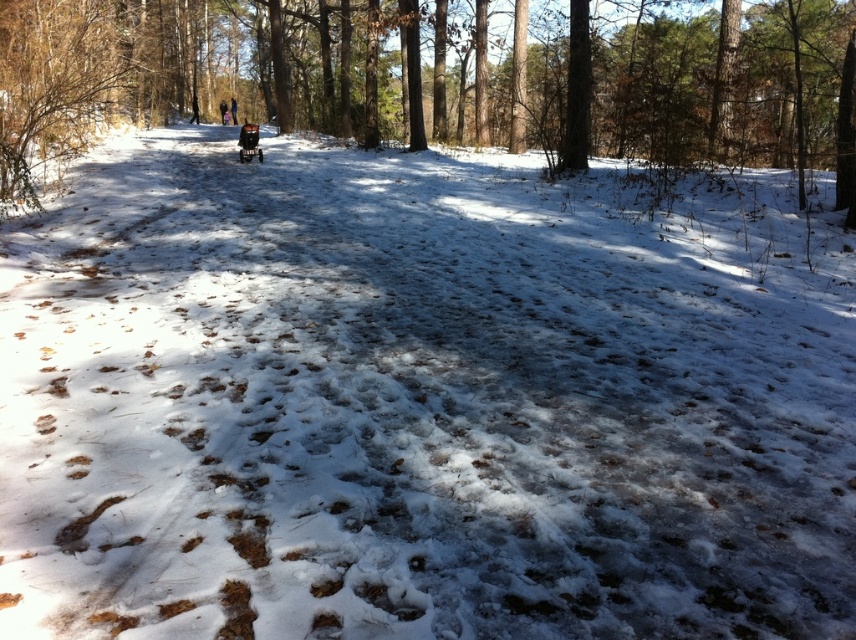
You are standing at the stroller on the path and want to walk towards the two points labeled as point (224, 120) and point (230, 97). Which point should you head towards if you want to reach the one that is closer to you?

You should head towards point (224, 120) because it is closer to the viewer than point (230, 97).

You are navigating through the winter forest path and see two points marked on your map. The first point is at coordinate point(734, 72) and the second is at point(230, 100). Which point is closer to you as you walk along the path?

Point(734, 72) is in front of point(230, 100), so the first point is closer to you as you walk along the path.